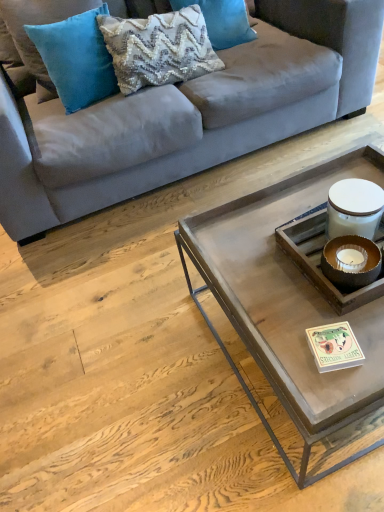
Question: Does teal velvet pillow at upper left, arranged as the 3th pillow when viewed from the right, have a greater width compared to metallic gray tray at center?

Choices:
 (A) no
 (B) yes

Answer: (A)

Question: Is teal velvet pillow at upper left, arranged as the 3th pillow when viewed from the right, further to the viewer compared to metallic gray tray at center?

Choices:
 (A) no
 (B) yes

Answer: (B)

Question: Is teal velvet pillow at upper left, arranged as the 3th pillow when viewed from the right, far away from metallic gray tray at center?

Choices:
 (A) no
 (B) yes

Answer: (B)

Question: Considering the relative positions of teal velvet pillow at upper left, which is the 1th pillow from left to right, and metallic gray tray at center in the image provided, is teal velvet pillow at upper left, which is the 1th pillow from left to right, in front of metallic gray tray at center?

Choices:
 (A) yes
 (B) no

Answer: (B)

Question: Is teal velvet pillow at upper left, which is the 1th pillow from left to right, facing away from metallic gray tray at center?

Choices:
 (A) yes
 (B) no

Answer: (B)

Question: Is teal velvet pillow at upper left, arranged as the 3th pillow when viewed from the right, bigger than metallic gray tray at center?

Choices:
 (A) yes
 (B) no

Answer: (B)

Question: Is suede gray couch at upper center to the left of metallic gray tray at center from the viewer's perspective?

Choices:
 (A) yes
 (B) no

Answer: (A)

Question: Is suede gray couch at upper center oriented towards metallic gray tray at center?

Choices:
 (A) no
 (B) yes

Answer: (A)

Question: From the image's perspective, is suede gray couch at upper center located above metallic gray tray at center?

Choices:
 (A) yes
 (B) no

Answer: (A)

Question: Considering the relative positions of suede gray couch at upper center and metallic gray tray at center in the image provided, is suede gray couch at upper center behind metallic gray tray at center?

Choices:
 (A) no
 (B) yes

Answer: (B)

Question: Is suede gray couch at upper center oriented away from metallic gray tray at center?

Choices:
 (A) yes
 (B) no

Answer: (B)

Question: Is the surface of suede gray couch at upper center in direct contact with metallic gray tray at center?

Choices:
 (A) yes
 (B) no

Answer: (B)

Question: Is suede gray couch at upper center positioned far away from woven fabric pillow at upper center, the 3th pillow viewed from the left?

Choices:
 (A) no
 (B) yes

Answer: (A)